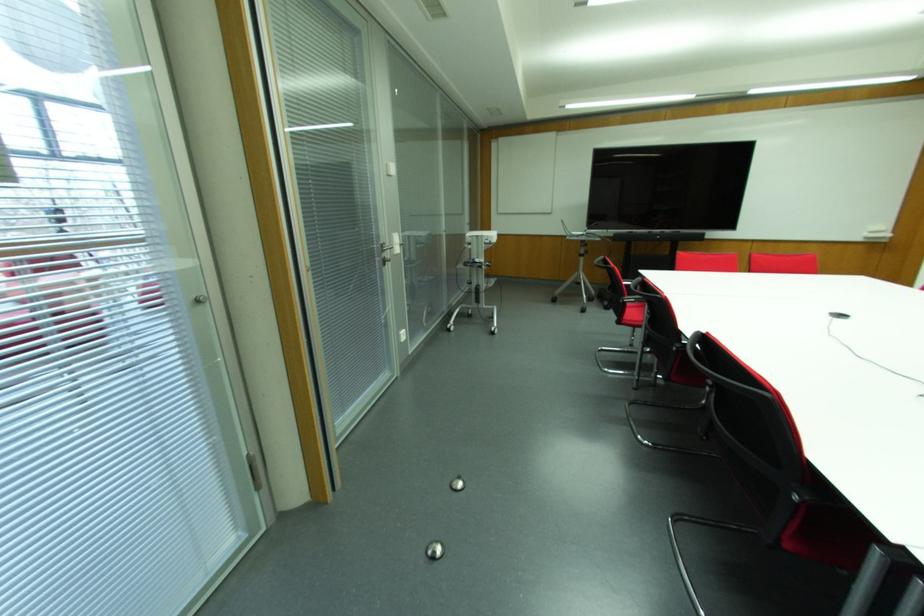
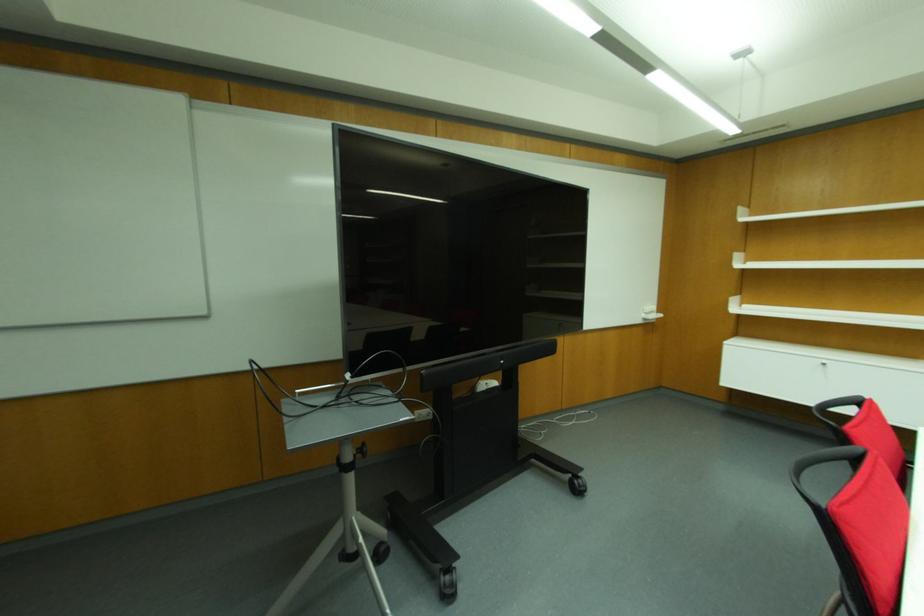
In the second image, find the point that corresponds to pixel 586 252 in the first image.

(360, 450)